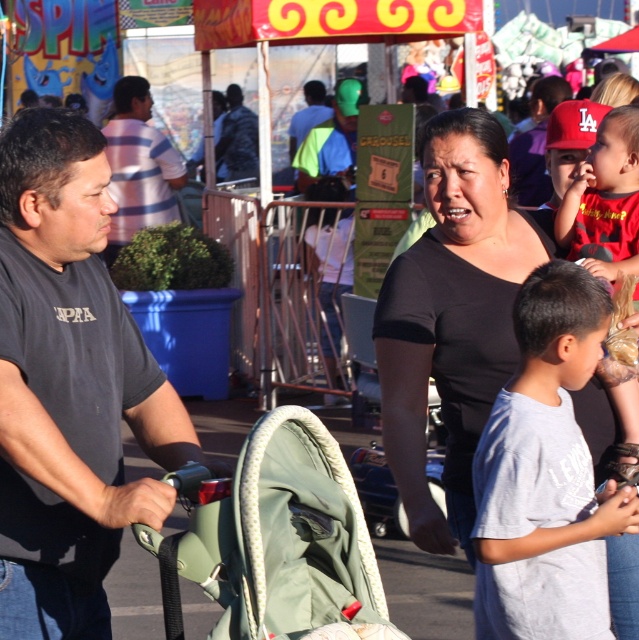
Question: Does striped cotton shirt at left appear under blue fabric shirt at center?

Choices:
 (A) no
 (B) yes

Answer: (B)

Question: Which of the following is the farthest from the observer?

Choices:
 (A) dark blue jacket at center
 (B) striped cotton shirt at left

Answer: (A)

Question: Which point appears farthest from the camera in this image?

Choices:
 (A) (128, 212)
 (B) (178, 609)
 (C) (320, 109)
 (D) (249, 131)

Answer: (D)

Question: Can you confirm if striped cotton shirt at left is positioned above blue fabric shirt at center?

Choices:
 (A) yes
 (B) no

Answer: (B)

Question: Is gray cotton shirt at lower right to the right of blue fabric shirt at center from the viewer's perspective?

Choices:
 (A) no
 (B) yes

Answer: (B)

Question: Which of the following is the farthest from the observer?

Choices:
 (A) (339, 605)
 (B) (551, 339)
 (C) (250, 145)
 (D) (144, 180)

Answer: (C)